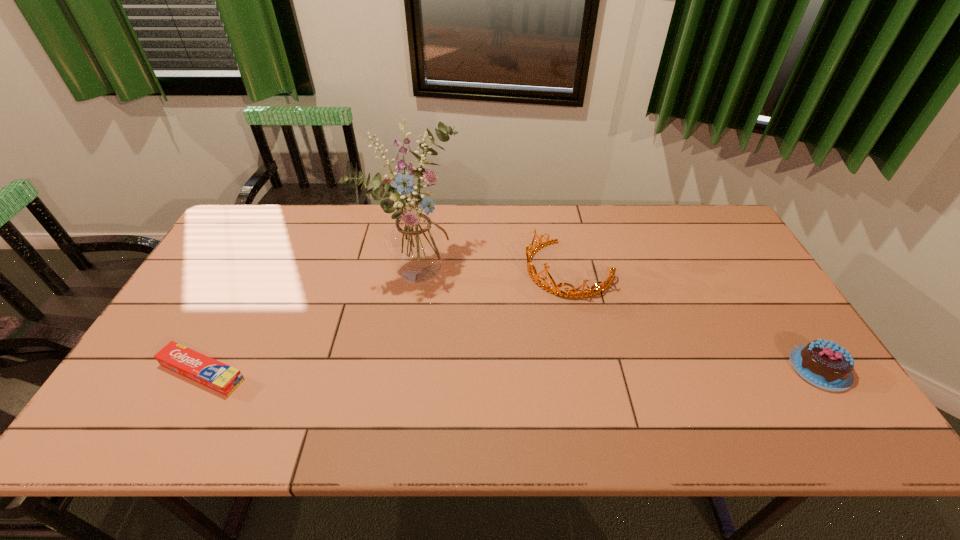
The width and height of the screenshot is (960, 540). I want to click on vacant spot on the desktop that is between the shortest object and the second shortest object and is positioned on the front-facing side of the second tallest object, so click(454, 371).

You are a GUI agent. You are given a task and a screenshot of the screen. Output one action in this format:
    pyautogui.click(x=<x>, y=<y>)
    Task: Click on the free space on the desktop that is between the toothpaste and the third tallest object and is positioned on the front-facing side of the tallest object
    Image resolution: width=960 pixels, height=540 pixels.
    Given the screenshot: What is the action you would take?
    [x=591, y=370]